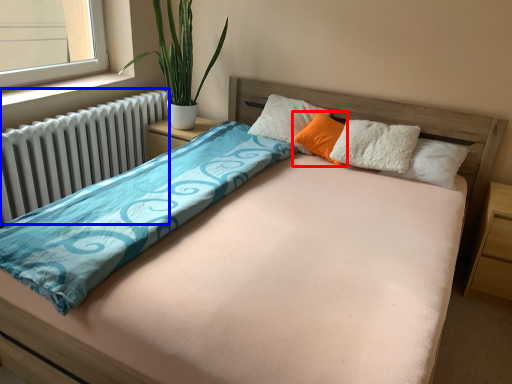
Question: Which object appears farthest to the camera in this image, pillow (highlighted by a red box) or radiator (highlighted by a blue box)?

Choices:
 (A) pillow
 (B) radiator

Answer: (A)